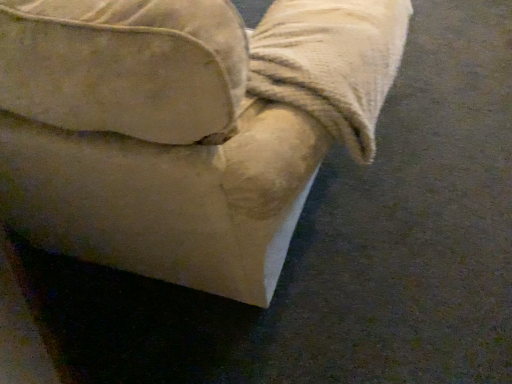
Find the location of a particular element. velvet beige armchair at center is located at coordinates (184, 127).

What do you see at coordinates (184, 127) in the screenshot? The image size is (512, 384). I see `velvet beige armchair at center` at bounding box center [184, 127].

You are a GUI agent. You are given a task and a screenshot of the screen. Output one action in this format:
    pyautogui.click(x=<x>, y=<y>)
    Task: Click on the velvet beige armchair at center
    
    Given the screenshot: What is the action you would take?
    pyautogui.click(x=184, y=127)